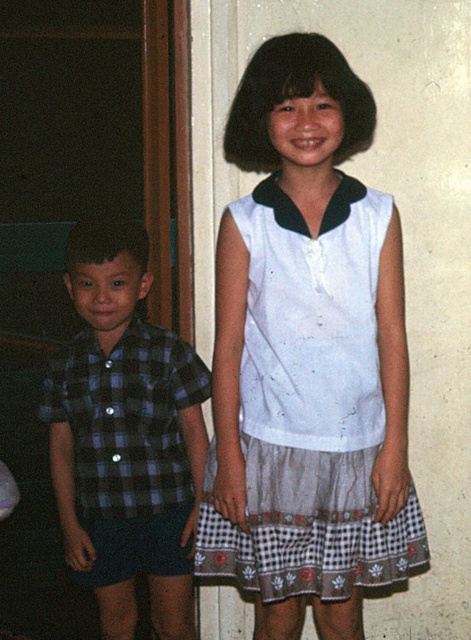
Question: Which object is farther from the camera taking this photo?

Choices:
 (A) plaid fabric shirt at left
 (B) white cotton dress at upper center

Answer: (A)

Question: Can you confirm if checkered fabric shirt at left is positioned to the left of plaid fabric shirt at left?

Choices:
 (A) yes
 (B) no

Answer: (B)

Question: Which point is closer to the camera?

Choices:
 (A) white cotton dress at upper center
 (B) checkered fabric shirt at left

Answer: (A)

Question: Is checkered fabric shirt at left to the left of plaid fabric shirt at left from the viewer's perspective?

Choices:
 (A) yes
 (B) no

Answer: (B)

Question: Among these points, which one is nearest to the camera?

Choices:
 (A) (417, 516)
 (B) (162, 384)

Answer: (A)

Question: Is white cotton dress at upper center positioned before checkered fabric shirt at left?

Choices:
 (A) no
 (B) yes

Answer: (B)